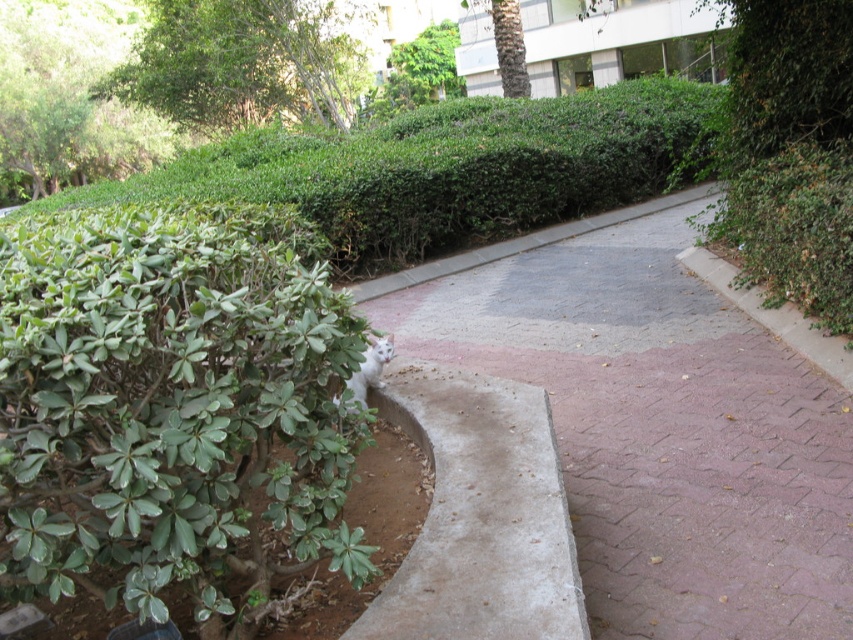
You are standing at the entrance of the garden and want to take a photo of both the pink brick pavement at center and the brown textured palm tree at upper center. Which object should you position closer to the left side of your camera frame to include both in the shot?

You should position the pink brick pavement at center closer to the left side of your camera frame since it is already on the left side of the brown textured palm tree at upper center in the scene.

You are a gardener planning to trim the green leafy bush at lower left and the brown textured palm tree at upper center. Which of these two plants requires trimming first if you want to start with the taller one?

The green leafy bush at lower left is much taller than the brown textured palm tree at upper center, so you should trim the green leafy bush at lower left first.